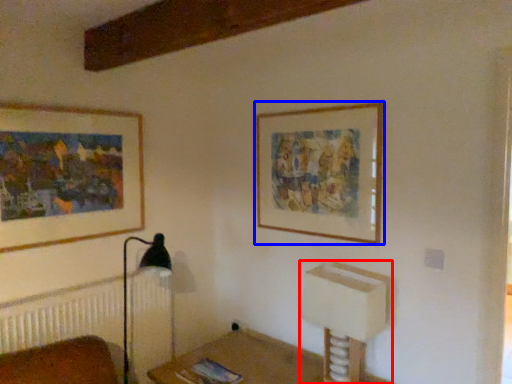
Question: Which object appears farthest to the camera in this image, vanity (highlighted by a red box) or picture frame (highlighted by a blue box)?

Choices:
 (A) vanity
 (B) picture frame

Answer: (B)